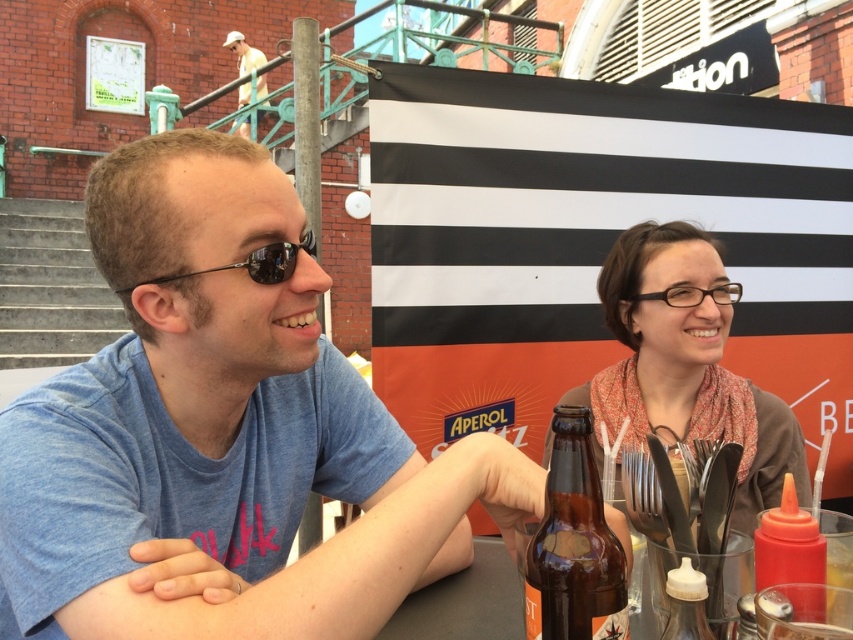
Is point (281, 620) farther from camera compared to point (245, 54)?

No, it is in front of (245, 54).

Who is more forward, (91, 422) or (245, 99)?

Point (91, 422) is more forward.

Does point (236, 561) come in front of point (244, 102)?

Yes, point (236, 561) is in front of point (244, 102).

Where is `blue cotton shirt at left`? The width and height of the screenshot is (853, 640). blue cotton shirt at left is located at coordinates (222, 429).

Can you confirm if blue cotton shirt at left is positioned below brown glass bottle at center?

No.

Can you confirm if blue cotton shirt at left is positioned above brown glass bottle at center?

Yes, blue cotton shirt at left is above brown glass bottle at center.

Identify the location of blue cotton shirt at left. (222, 429).

Locate an element on the screen. matte brown scarf at right is located at coordinates (686, 364).

Is the position of matte brown scarf at right less distant than that of brown glass bottle at center?

No, it is not.

Is point (717, 372) behind point (585, 468)?

Yes.

Find the location of a particular element. matte brown scarf at right is located at coordinates (686, 364).